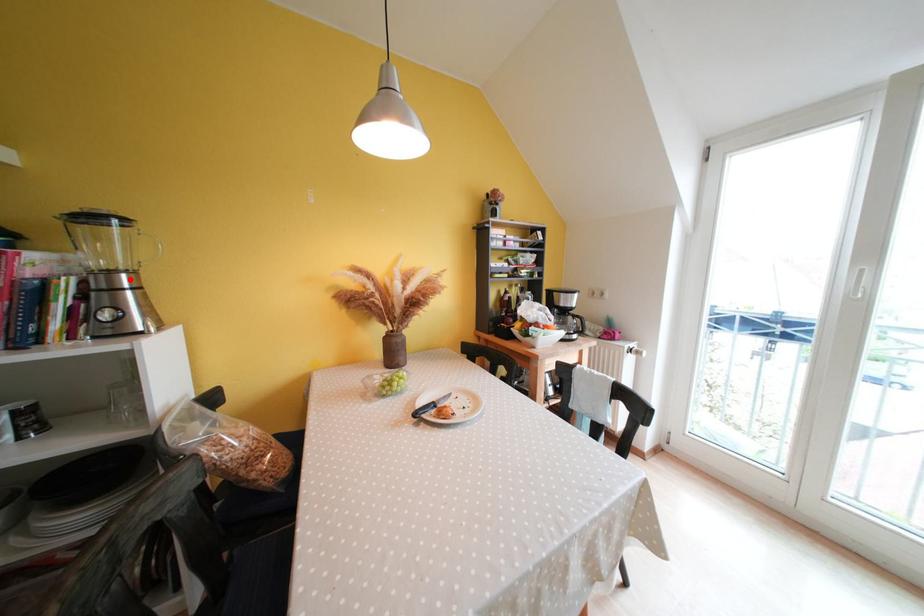
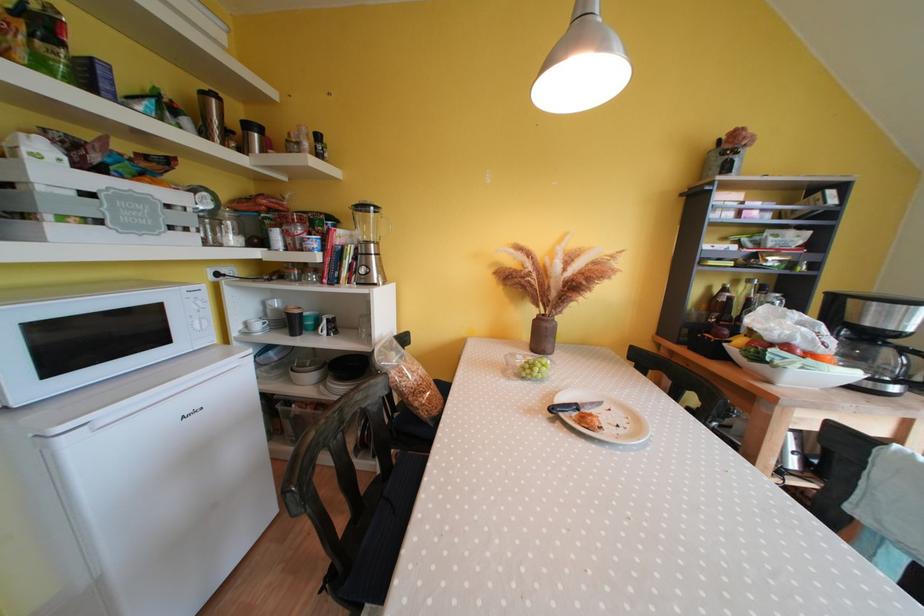
Question: I am providing you with two images of the same scene from different viewpoints. A red point is marked on the first image. At the location where the point appears in image 1, is it still visible in image 2?

Choices:
 (A) Yes
 (B) No

Answer: (A)